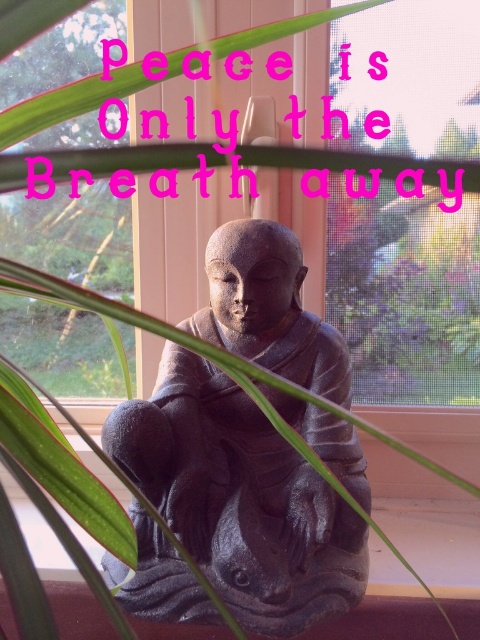
From the picture: You are an interior designer planning to place a new decorative item on the windowsill where the matte gray stone statue at center and transparent mesh at center are currently located. To ensure proper spacing, you need to know if the statue is wider than the mesh. Can you determine this based on the current arrangement?

The matte gray stone statue at center might be wider than transparent mesh at center, so there is a possibility that the statue is wider. However, the exact dimensions are uncertain, so you may need to measure both to confirm.

You are standing in front of the scene and want to touch both the matte gray stone statue at center and the transparent mesh at center. Which object will your hand reach first?

The matte gray stone statue at center is closer to the viewer than the transparent mesh at center, so your hand will reach the matte gray stone statue at center first.

You are standing in front of the image and want to know how far the point at coordinates (x=369, y=506) is from you. Can you determine the distance?

The point at coordinates (x=369, y=506) is 1.02 meters away from the camera, so the distance from you to that point is approximately 1.02 meters.